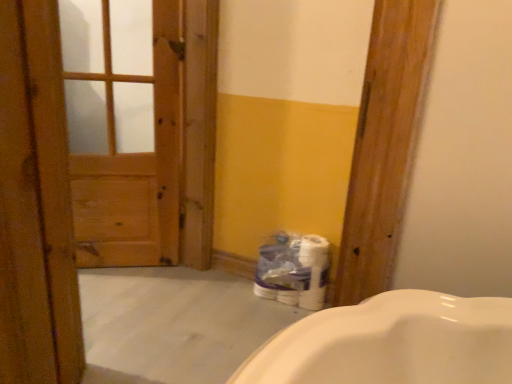
Identify the location of free space between wooden door at left and white glossy toilet paper at lower center. (204, 314).